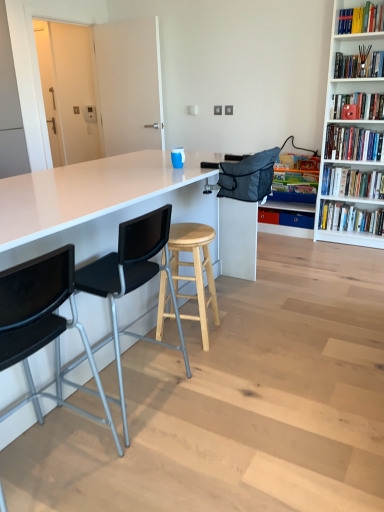
Locate an element on the screen. The height and width of the screenshot is (512, 384). vacant area on top of blue plastic drawer at center (from a real-world perspective) is located at coordinates (293, 207).